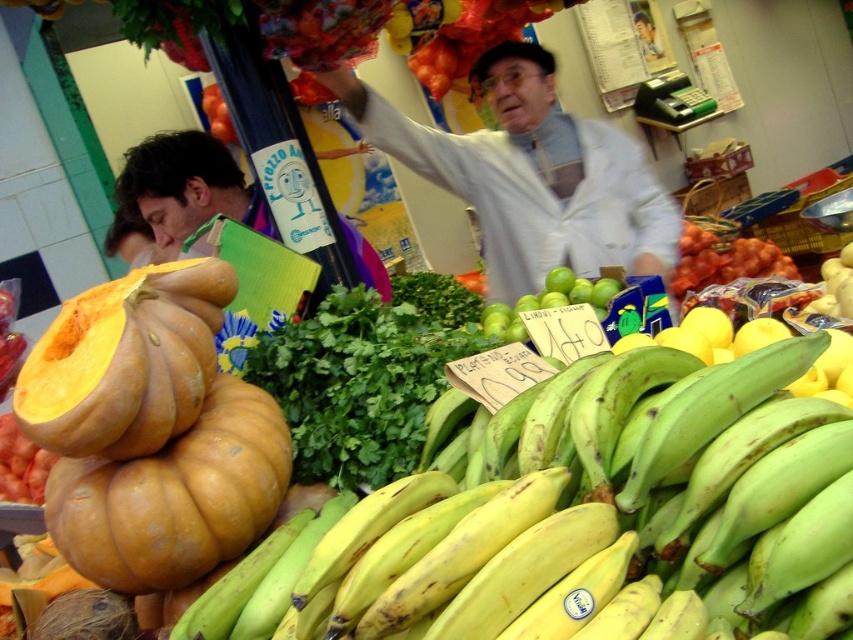
You are standing at the market stall and want to find the yellow bananas. There is a point marked at coordinates (x=584, y=509). What does this point indicate?

The point at coordinates (x=584, y=509) indicates yellow bananas at lower left.